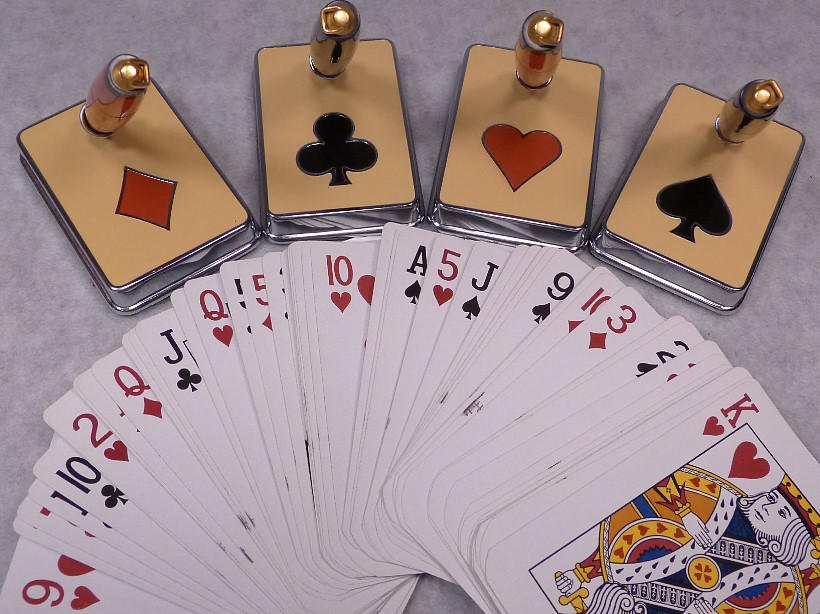
At what (x,y) coordinates should I click in order to perform the action: click on gold cylindrical knob. Please return your answer as a coordinate pair (x, y). This screenshot has height=614, width=820. Looking at the image, I should click on (x=108, y=99), (x=345, y=39), (x=540, y=55), (x=745, y=119).